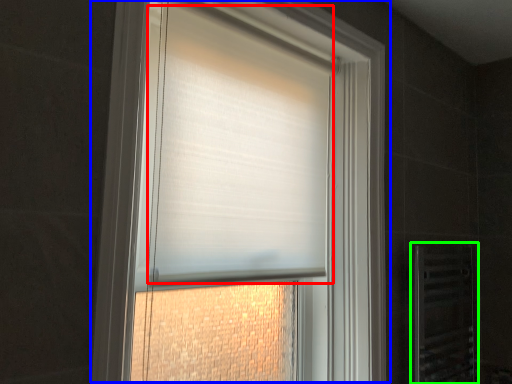
Question: Considering the real-world distances, which object is closest to blind (highlighted by a red box)? window (highlighted by a blue box) or screen door (highlighted by a green box).

Choices:
 (A) window
 (B) screen door

Answer: (A)